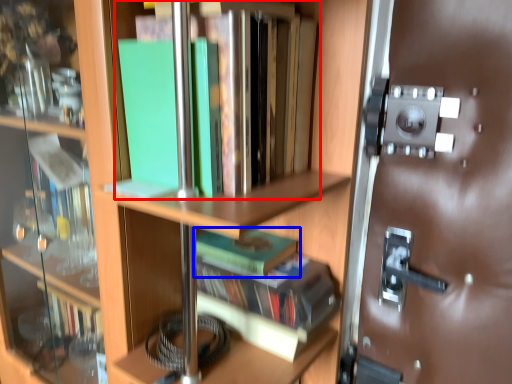
Question: Which of the following is the farthest to the observer, book (highlighted by a red box) or book (highlighted by a blue box)?

Choices:
 (A) book
 (B) book

Answer: (B)